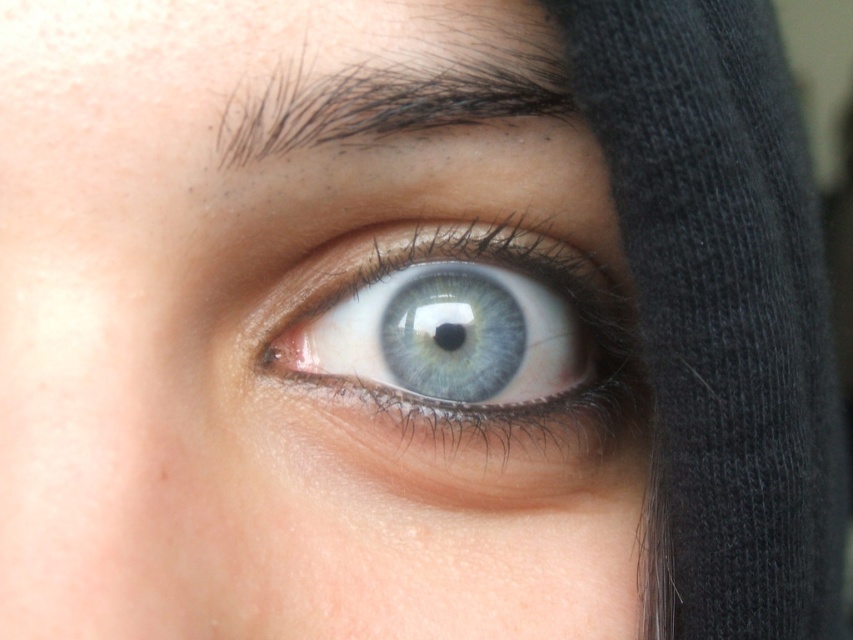
Does point (473, 257) come behind point (305, 74)?

Yes.

Who is more distant from viewer, (424, 241) or (378, 104)?

Point (424, 241)

Does point (415, 429) lie in front of point (314, 122)?

No, (415, 429) is further to viewer.

Find the location of a particular element. The width and height of the screenshot is (853, 640). blue glassy eye at center is located at coordinates (473, 337).